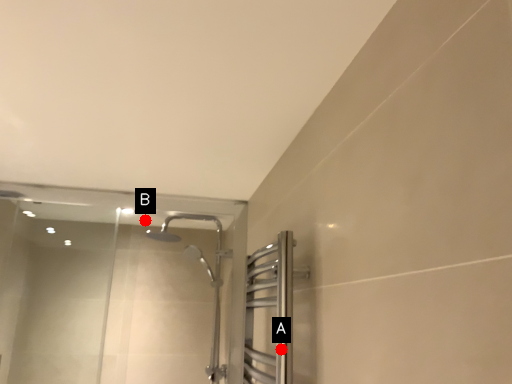
Question: Two points are circled on the image, labeled by A and B beside each circle. Which point appears closest to the camera in this image?

Choices:
 (A) A is closer
 (B) B is closer

Answer: (A)